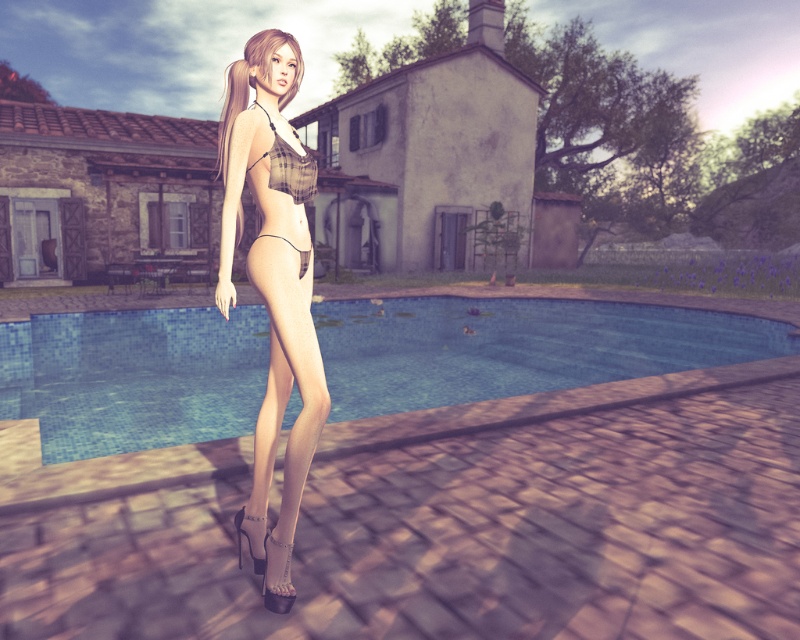
Does blue tile pool at center have a greater height compared to matte plaid bikini at center?

No.

Is point (113, 392) positioned behind point (293, 346)?

Yes, it is.

Where is `blue tile pool at center`? blue tile pool at center is located at coordinates (516, 348).

Find the location of a particular element. blue tile pool at center is located at coordinates (516, 348).

Is matte black bikini at center thinner than clear plastic thong at center?

No.

Does point (230, 104) come behind point (304, 273)?

Yes, it is.

The image size is (800, 640). What do you see at coordinates (252, 83) in the screenshot?
I see `matte black bikini at center` at bounding box center [252, 83].

Image resolution: width=800 pixels, height=640 pixels. Find the location of `matte black bikini at center`. matte black bikini at center is located at coordinates (252, 83).

Is matte plaid bikini at center above matte black bikini at center?

Actually, matte plaid bikini at center is below matte black bikini at center.

Is matte plaid bikini at center taller than matte black bikini at center?

In fact, matte plaid bikini at center may be shorter than matte black bikini at center.

Where is `matte plaid bikini at center`? This screenshot has height=640, width=800. matte plaid bikini at center is located at coordinates (282, 413).